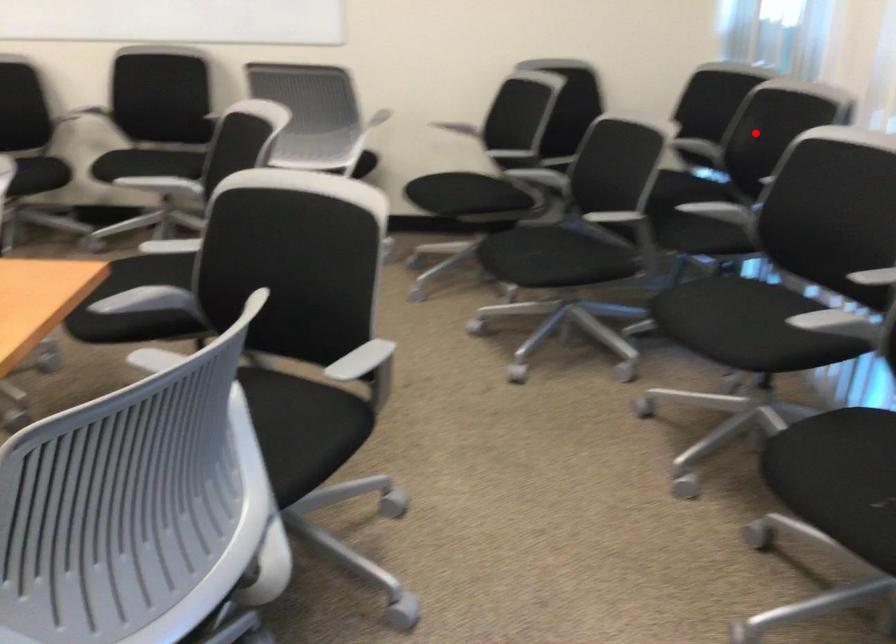
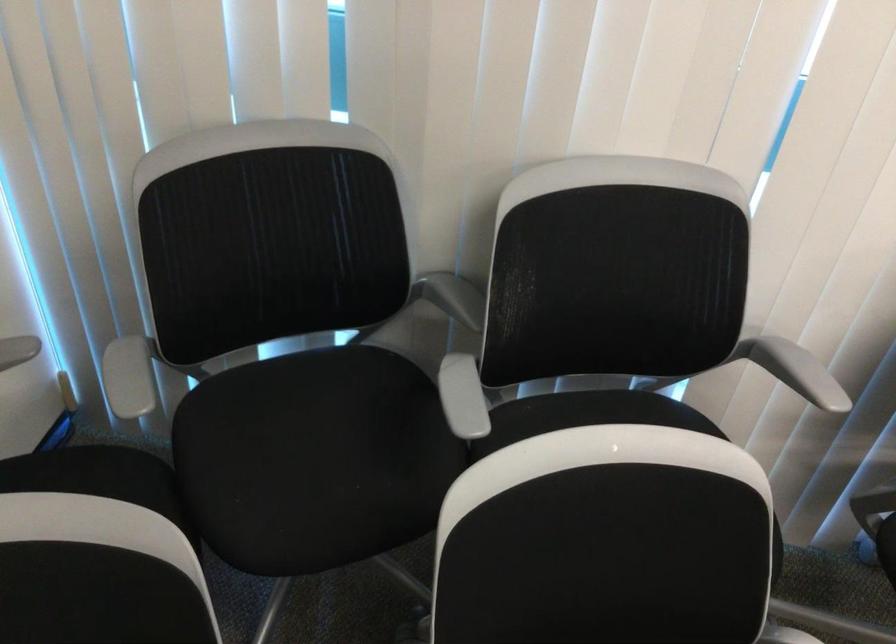
Question: I am providing you with two images of the same scene from different viewpoints. A red point is marked on the first image. Can you still see the location of the red point in image 2?

Choices:
 (A) Yes
 (B) No

Answer: (A)